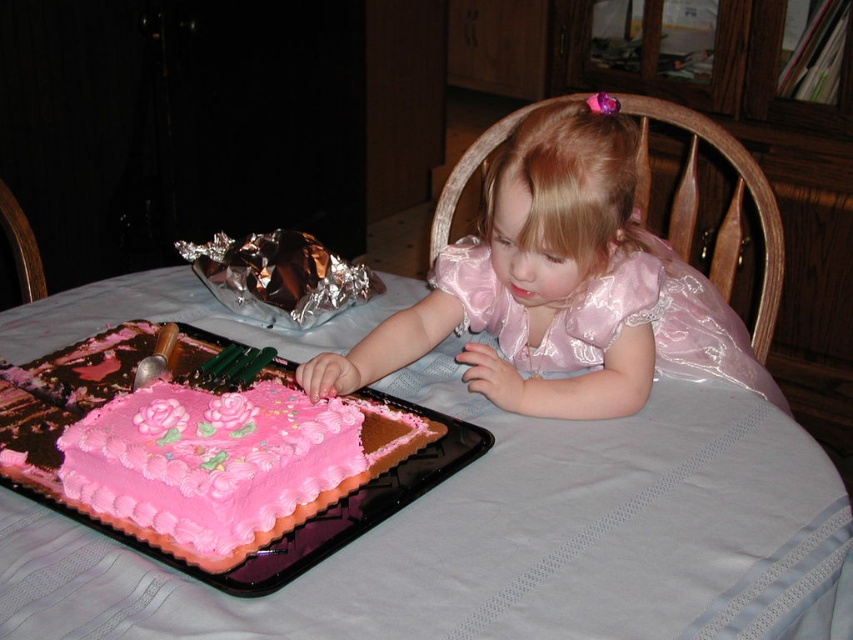
Question: Can you confirm if pink frosted cake at lower left is positioned above pink shiny dress at upper center?

Choices:
 (A) no
 (B) yes

Answer: (A)

Question: Which is farther from the shiny metallic foil at center?

Choices:
 (A) pink shiny dress at upper center
 (B) white cloth table at center
 (C) pink frosted cake at lower left

Answer: (A)

Question: Is pink frosted cake at lower left below shiny metallic foil at center?

Choices:
 (A) yes
 (B) no

Answer: (A)

Question: From the image, what is the correct spatial relationship of pink satin dress at center in relation to shiny metallic foil at center?

Choices:
 (A) right
 (B) left

Answer: (A)

Question: Which object appears closest to the camera in this image?

Choices:
 (A) pink satin dress at center
 (B) pink frosted cake at lower left
 (C) white cloth table at center

Answer: (C)

Question: Among these objects, which one is nearest to the camera?

Choices:
 (A) pink frosted cake at lower left
 (B) shiny metallic foil at center
 (C) pink shiny dress at upper center
 (D) white cloth table at center

Answer: (D)